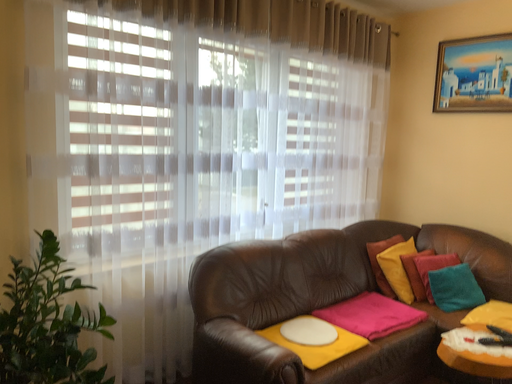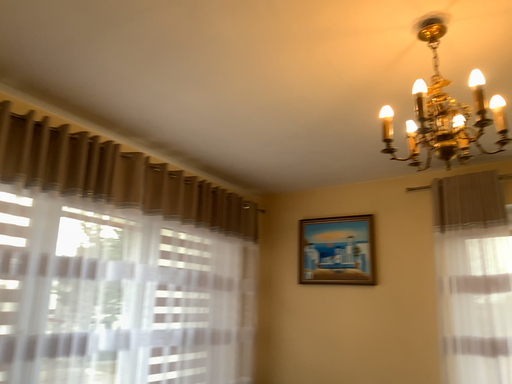
Question: How did the camera likely rotate when shooting the video?

Choices:
 (A) rotated upward
 (B) rotated downward

Answer: (A)